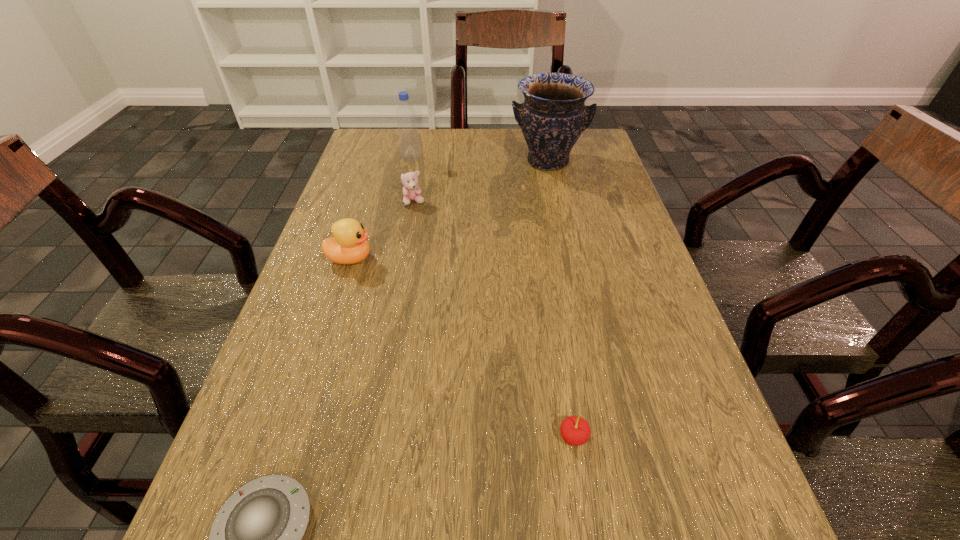
Where is `vacant space at the right edge`? This screenshot has width=960, height=540. vacant space at the right edge is located at coordinates (583, 172).

The image size is (960, 540). I want to click on free space at the far left corner, so click(364, 164).

Image resolution: width=960 pixels, height=540 pixels. In order to click on vacant space at the far right corner of the desktop in this screenshot , I will do `click(581, 151)`.

In order to click on vacant area between the bottle and the third nearest object in this screenshot , I will do `click(380, 208)`.

Where is `free space that is in between the bottle and the duckling`? Image resolution: width=960 pixels, height=540 pixels. free space that is in between the bottle and the duckling is located at coordinates (380, 208).

The image size is (960, 540). In order to click on free space between the teddy bear and the pottery in this screenshot , I will do `click(481, 182)`.

I want to click on vacant area that lies between the cherry and the third nearest object, so click(x=462, y=348).

The height and width of the screenshot is (540, 960). Find the location of `blank region between the fifth farthest object and the teddy bear`. blank region between the fifth farthest object and the teddy bear is located at coordinates (493, 319).

Where is `vacant area that lies between the pottery and the second nearest object`? vacant area that lies between the pottery and the second nearest object is located at coordinates click(x=561, y=299).

Find the location of a particular element. The width and height of the screenshot is (960, 540). free space between the fifth farthest object and the pottery is located at coordinates (561, 299).